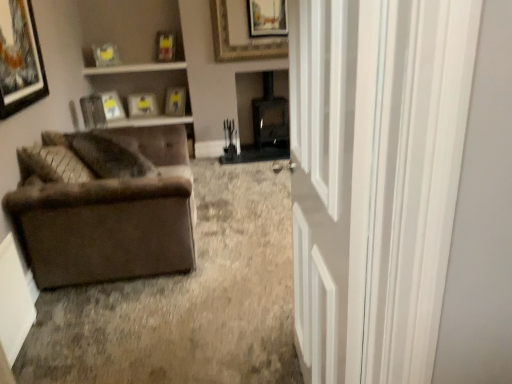
Question: Which direction should I rotate to face matte yellow picture frame at upper center, acting as the 7th picture frame starting from the front, — up or down?

Choices:
 (A) up
 (B) down

Answer: (A)

Question: From the image's perspective, is white glossy door at right over gold-framed picture at upper center, the sixth picture frame positioned from the back?

Choices:
 (A) no
 (B) yes

Answer: (A)

Question: Does white glossy door at right have a lesser width compared to gold-framed picture at upper center, the 3th picture frame when ordered from front to back?

Choices:
 (A) no
 (B) yes

Answer: (A)

Question: Does white glossy door at right have a lesser height compared to gold-framed picture at upper center, the sixth picture frame positioned from the back?

Choices:
 (A) no
 (B) yes

Answer: (A)

Question: Could you tell me if white glossy door at right is facing gold-framed picture at upper center, the 3th picture frame when ordered from front to back?

Choices:
 (A) no
 (B) yes

Answer: (A)

Question: Does white glossy door at right contain gold-framed picture at upper center, the 3th picture frame when ordered from front to back?

Choices:
 (A) no
 (B) yes

Answer: (A)

Question: Can you confirm if white glossy door at right is smaller than gold-framed picture at upper center, the sixth picture frame positioned from the back?

Choices:
 (A) yes
 (B) no

Answer: (B)

Question: Considering the relative positions of matte black picture frame at upper left, arranged as the 2th picture frame when viewed from the front, and matte wooden picture frame at upper center, placed as the 8th picture frame when sorted from front to back, in the image provided, is matte black picture frame at upper left, arranged as the 2th picture frame when viewed from the front, to the left of matte wooden picture frame at upper center, placed as the 8th picture frame when sorted from front to back, from the viewer's perspective?

Choices:
 (A) no
 (B) yes

Answer: (B)

Question: Does matte black picture frame at upper left, placed as the 7th picture frame when sorted from back to front, contain matte wooden picture frame at upper center, the first picture frame from the back?

Choices:
 (A) yes
 (B) no

Answer: (B)

Question: Is matte black picture frame at upper left, arranged as the 2th picture frame when viewed from the front, positioned beyond the bounds of matte wooden picture frame at upper center, the first picture frame from the back?

Choices:
 (A) no
 (B) yes

Answer: (B)

Question: From a real-world perspective, is matte black picture frame at upper left, arranged as the 2th picture frame when viewed from the front, beneath matte wooden picture frame at upper center, placed as the 8th picture frame when sorted from front to back?

Choices:
 (A) no
 (B) yes

Answer: (A)

Question: Is matte black picture frame at upper left, placed as the 7th picture frame when sorted from back to front, in front of matte wooden picture frame at upper center, the first picture frame from the back?

Choices:
 (A) no
 (B) yes

Answer: (B)

Question: Is matte black picture frame at upper left, arranged as the 2th picture frame when viewed from the front, touching matte wooden picture frame at upper center, placed as the 8th picture frame when sorted from front to back?

Choices:
 (A) yes
 (B) no

Answer: (B)

Question: From a real-world perspective, is matte yellow picture frame at upper center, acting as the 7th picture frame starting from the front, over white glossy door at right?

Choices:
 (A) yes
 (B) no

Answer: (B)